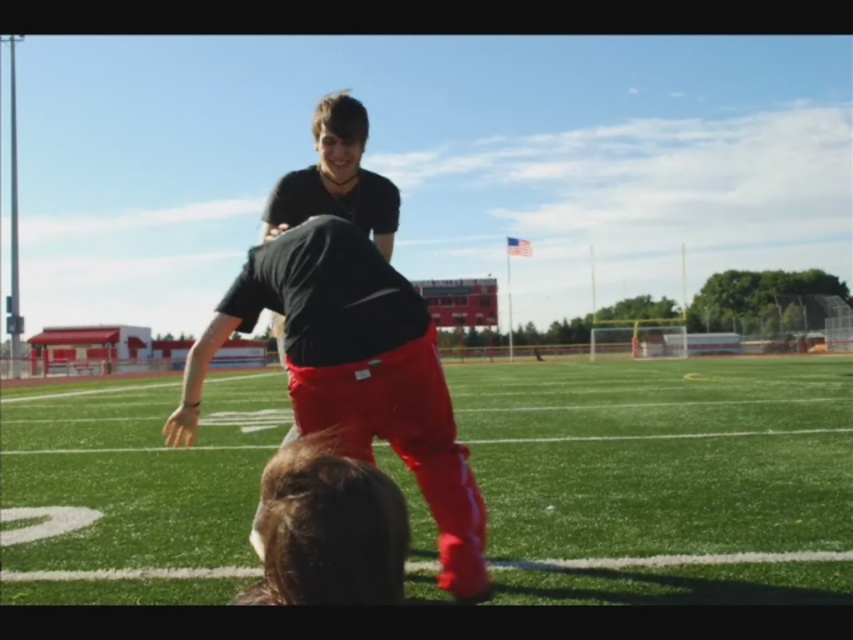
Between green grass football field at center and matte black shirt at center, which one is positioned lower?

green grass football field at center

You are a GUI agent. You are given a task and a screenshot of the screen. Output one action in this format:
    pyautogui.click(x=<x>, y=<y>)
    Task: Click on the green grass football field at center
    The height and width of the screenshot is (640, 853).
    Given the screenshot: What is the action you would take?
    (x=660, y=472)